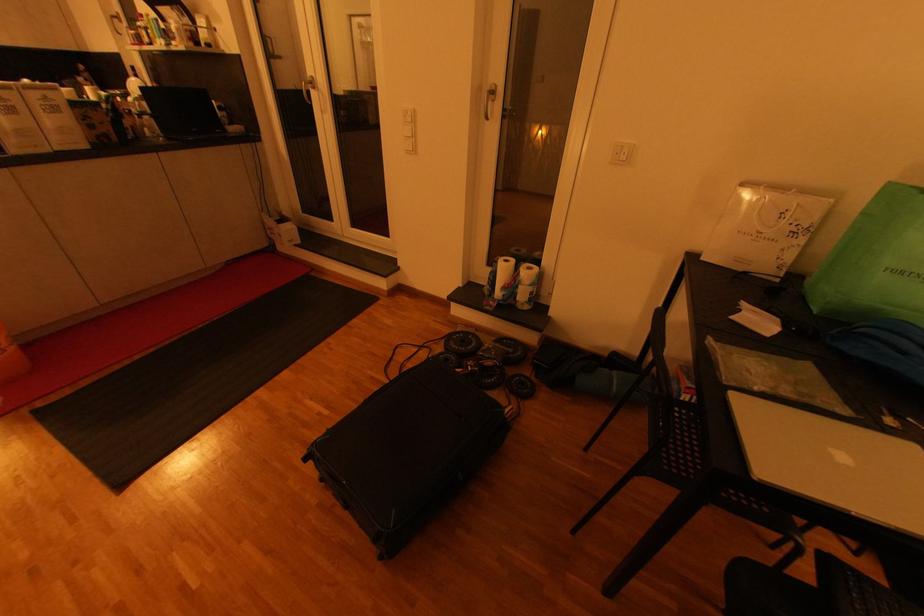
The width and height of the screenshot is (924, 616). Identify the location of chair sitting surface. (686, 451).